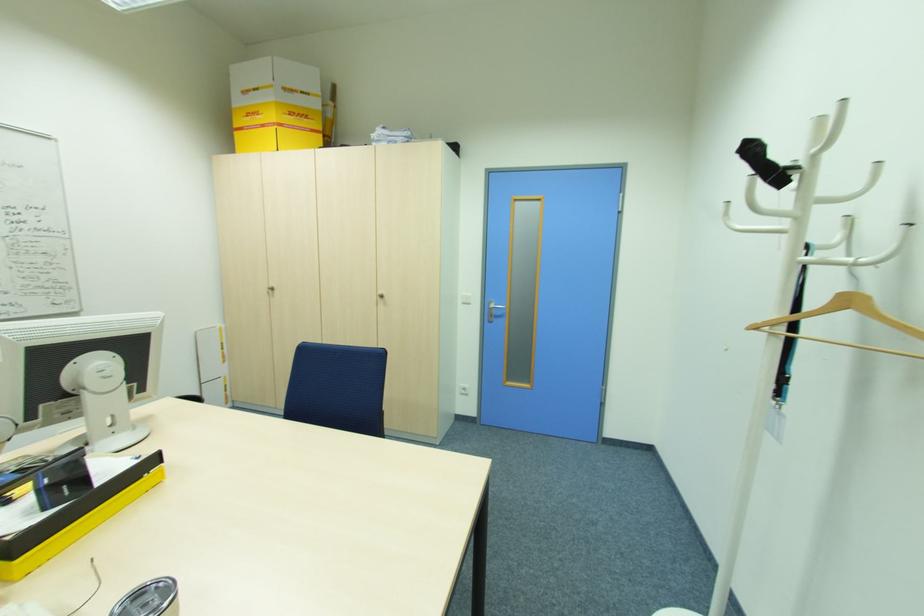
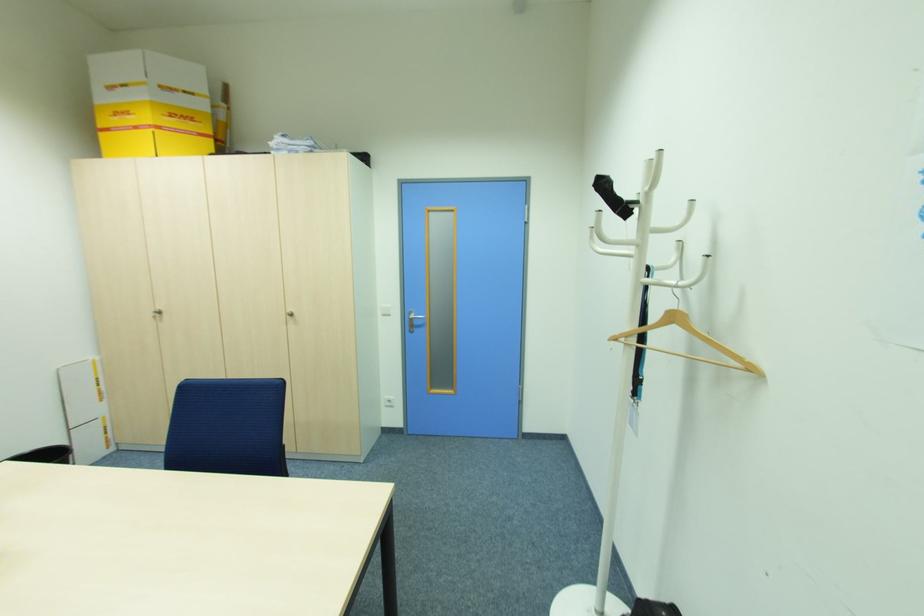
In the second image, find the point that corresponds to (873,166) in the first image.

(688, 204)